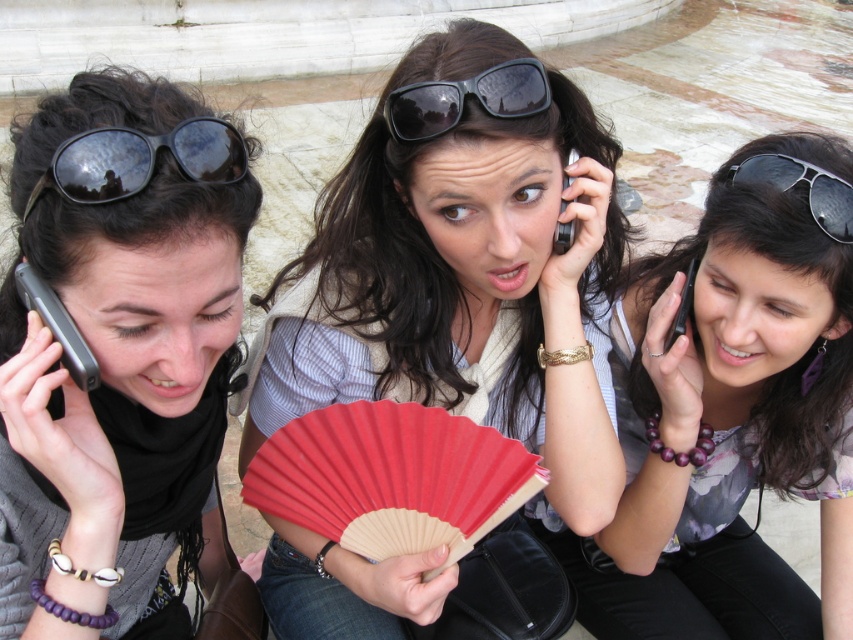
Can you confirm if black plastic phone at center is shorter than metallic silver phone at center?

Indeed, black plastic phone at center has a lesser height compared to metallic silver phone at center.

Does black plastic phone at center appear on the right side of metallic silver phone at center?

Indeed, black plastic phone at center is positioned on the right side of metallic silver phone at center.

Image resolution: width=853 pixels, height=640 pixels. What do you see at coordinates (682, 307) in the screenshot?
I see `black plastic phone at center` at bounding box center [682, 307].

Locate an element on the screen. The width and height of the screenshot is (853, 640). black plastic phone at center is located at coordinates (682, 307).

Is point (314, 611) positioned after point (567, 177)?

Yes.

Between matte red fan at center and metallic silver phone at center, which one is positioned higher?

metallic silver phone at center is above.

Does point (511, 595) come closer to viewer compared to point (569, 161)?

No, it is behind (569, 161).

At what (x,y) coordinates should I click in order to perform the action: click on matte red fan at center. Please return your answer as a coordinate pair (x, y). Looking at the image, I should click on (462, 266).

How far apart are purple beaded bracelet at center and black plastic phone at center?

52.80 centimeters

Is purple beaded bracelet at center to the left of black plastic phone at center from the viewer's perspective?

In fact, purple beaded bracelet at center is to the right of black plastic phone at center.

Is point (640, 355) positioned before point (679, 316)?

No, it is not.

The width and height of the screenshot is (853, 640). I want to click on purple beaded bracelet at center, so click(730, 417).